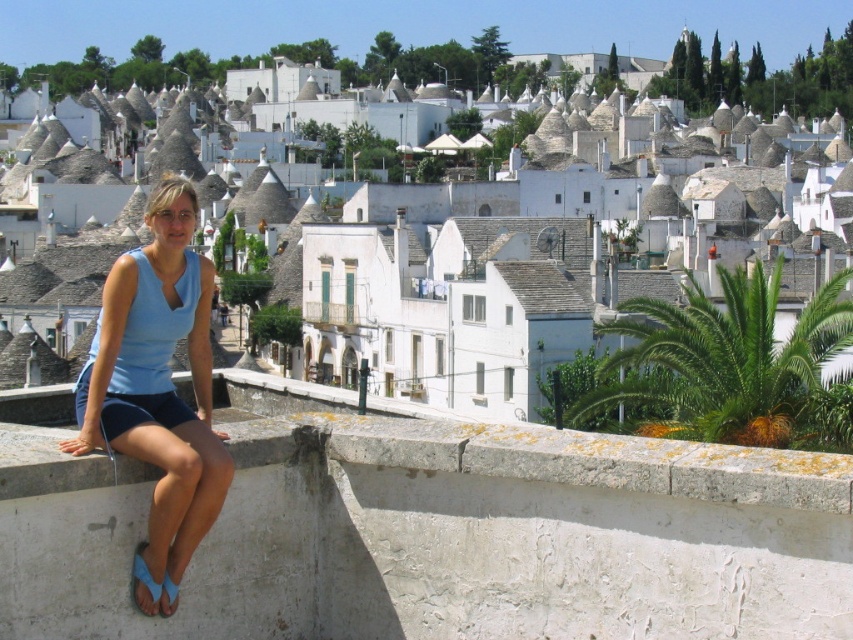
Question: Does white stone buildings at center have a lesser width compared to blue fabric shorts at lower left?

Choices:
 (A) yes
 (B) no

Answer: (B)

Question: Is white stone buildings at center to the left of blue fabric shorts at lower left from the viewer's perspective?

Choices:
 (A) yes
 (B) no

Answer: (B)

Question: Which point is closer to the camera?

Choices:
 (A) white stone buildings at center
 (B) blue fabric shorts at lower left

Answer: (B)

Question: Can you confirm if white stone buildings at center is positioned to the left of blue fabric shorts at lower left?

Choices:
 (A) no
 (B) yes

Answer: (A)

Question: Which point appears closest to the camera in this image?

Choices:
 (A) (86, 416)
 (B) (341, 294)

Answer: (A)